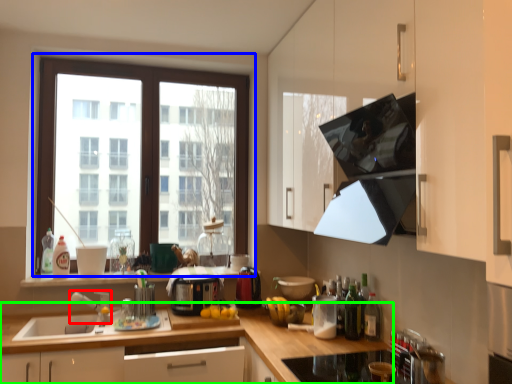
Question: Which is nearer to the faucet (highlighted by a red box)? window (highlighted by a blue box) or cabinetry (highlighted by a green box).

Choices:
 (A) window
 (B) cabinetry

Answer: (B)